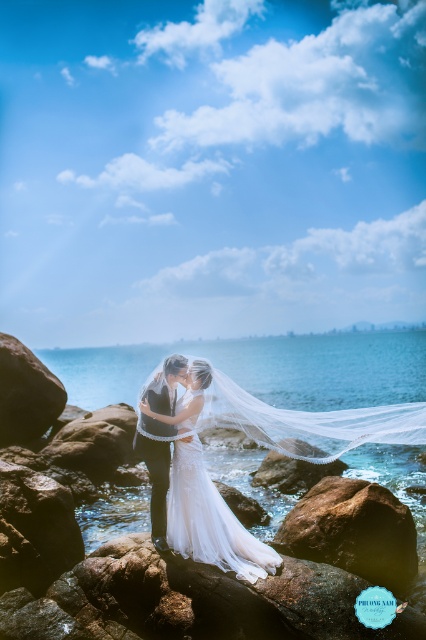
Does brown rough rock at lower center have a smaller size compared to white glossy stone at center?

No.

Is point (394, 563) farther from camera compared to point (293, 461)?

No, it is in front of (293, 461).

Locate an element on the screen. This screenshot has height=640, width=426. brown rough rock at lower center is located at coordinates (353, 531).

Is point (120, 504) positioned before point (287, 465)?

Yes, point (120, 504) is closer to viewer.

Is clear blue water at center shorter than white glossy stone at center?

In fact, clear blue water at center may be taller than white glossy stone at center.

What do you see at coordinates (261, 369) in the screenshot? This screenshot has height=640, width=426. I see `clear blue water at center` at bounding box center [261, 369].

Locate an element on the screen. Image resolution: width=426 pixels, height=640 pixels. clear blue water at center is located at coordinates (261, 369).

Who is taller, white lace dress at center or white glossy stone at center?

white lace dress at center

Does white lace dress at center appear over white glossy stone at center?

Yes.

Locate an element on the screen. This screenshot has width=426, height=640. white lace dress at center is located at coordinates (210, 516).